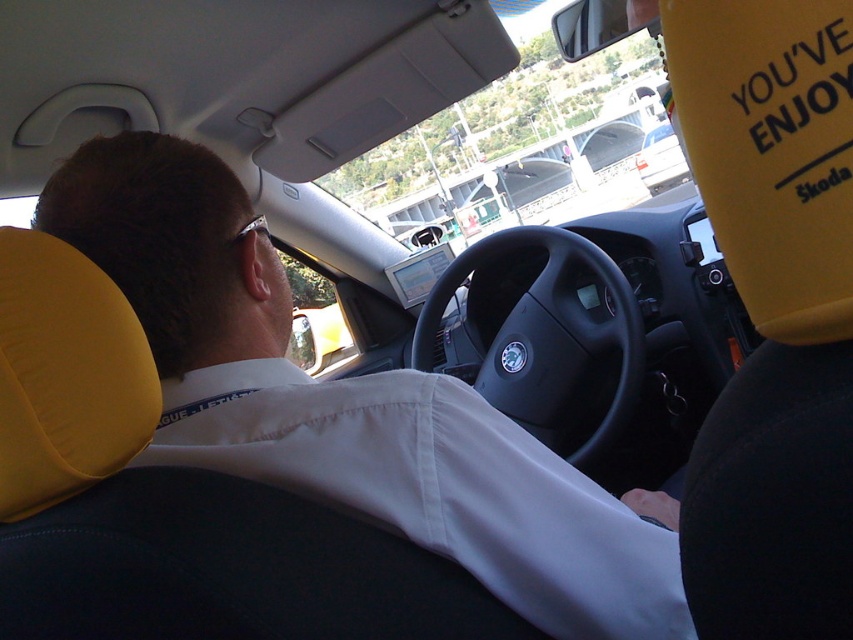
Between white fabric shirt at upper left and black matte steering wheel at center, which one is positioned higher?

Positioned higher is black matte steering wheel at center.

Where is `white fabric shirt at upper left`? white fabric shirt at upper left is located at coordinates (350, 404).

This screenshot has width=853, height=640. I want to click on white fabric shirt at upper left, so click(350, 404).

Between white fabric shirt at upper left and white matte van at center, which one appears on the right side from the viewer's perspective?

white matte van at center is more to the right.

Which is below, white fabric shirt at upper left or white matte van at center?

white fabric shirt at upper left is below.

Describe the element at coordinates (350, 404) in the screenshot. I see `white fabric shirt at upper left` at that location.

Locate an element on the screen. This screenshot has width=853, height=640. white fabric shirt at upper left is located at coordinates (350, 404).

Can you confirm if black matte steering wheel at center is shorter than white matte van at center?

Correct, black matte steering wheel at center is not as tall as white matte van at center.

Based on the photo, can you confirm if black matte steering wheel at center is positioned to the left of white matte van at center?

Correct, you'll find black matte steering wheel at center to the left of white matte van at center.

Image resolution: width=853 pixels, height=640 pixels. What do you see at coordinates (544, 337) in the screenshot?
I see `black matte steering wheel at center` at bounding box center [544, 337].

In order to click on black matte steering wheel at center in this screenshot , I will do `click(544, 337)`.